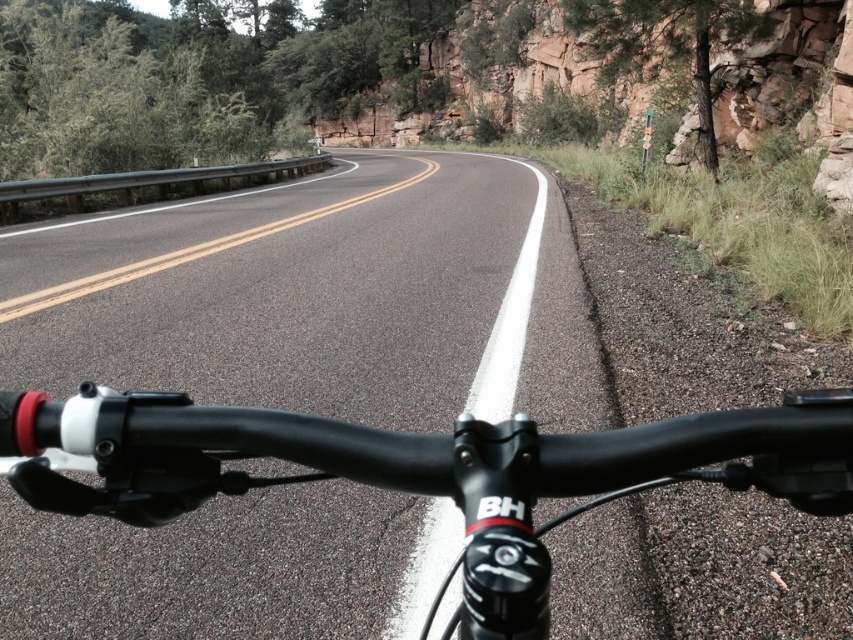
Question: Which point appears closest to the camera in this image?

Choices:
 (A) (426, 464)
 (B) (196, 284)

Answer: (A)

Question: Does black asphalt road at center appear under black matte bicycle handlebars at center?

Choices:
 (A) yes
 (B) no

Answer: (B)

Question: Does black asphalt road at center have a smaller size compared to black matte bicycle handlebars at center?

Choices:
 (A) yes
 (B) no

Answer: (B)

Question: Which point is closer to the camera?

Choices:
 (A) black matte bicycle handlebars at center
 (B) black asphalt road at center

Answer: (A)

Question: Can you confirm if black asphalt road at center is wider than black matte bicycle handlebars at center?

Choices:
 (A) yes
 (B) no

Answer: (A)